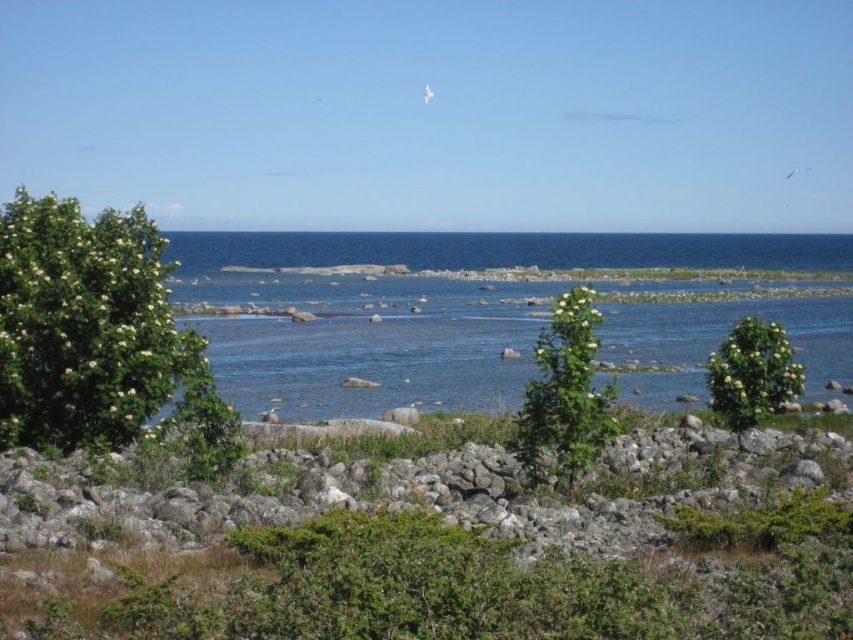
You are a hiker who wants to place a 1.2 meter wide tent between the gray rock at center and the green leafy bush at left. Can the space between them accommodate the tent?

The gray rock at center is wider than the green leafy bush at left, but the exact distance between them isn

You are standing at the edge of the rocky terrain and want to walk towards the gray rock at center. Which direction should you head relative to the green leafy bush at left?

You should head to the right of the green leafy bush at left because the gray rock at center is located to the right of it.

You are a hiker trying to cross the rocky terrain in the coastal landscape. You notice a gray rock at center and a green leafy bush at left. Which object would you choose to step on for a more stable footing, and why?

The gray rock at center is bigger than the green leafy bush at left, so stepping on the gray rock at center would provide a more stable footing because larger rocks are generally more stable than smaller bushes.